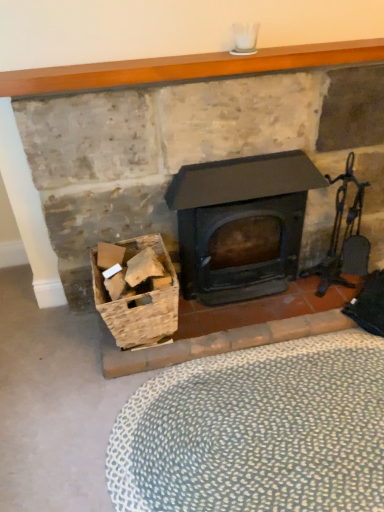
Image resolution: width=384 pixels, height=512 pixels. I want to click on free space in front of matte black stove at center, so click(x=228, y=415).